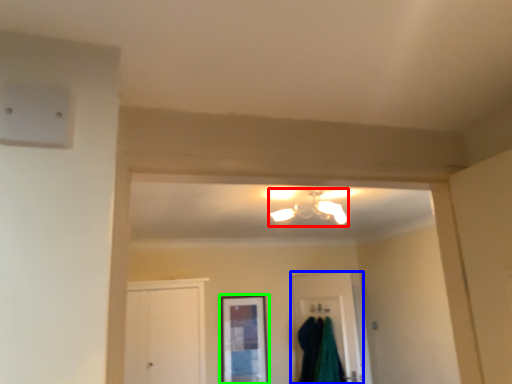
Question: Estimate the real-world distances between objects in this image. Which object is closer to light fixture (highlighted by a red box), door (highlighted by a blue box) or window (highlighted by a green box)?

Choices:
 (A) door
 (B) window

Answer: (A)